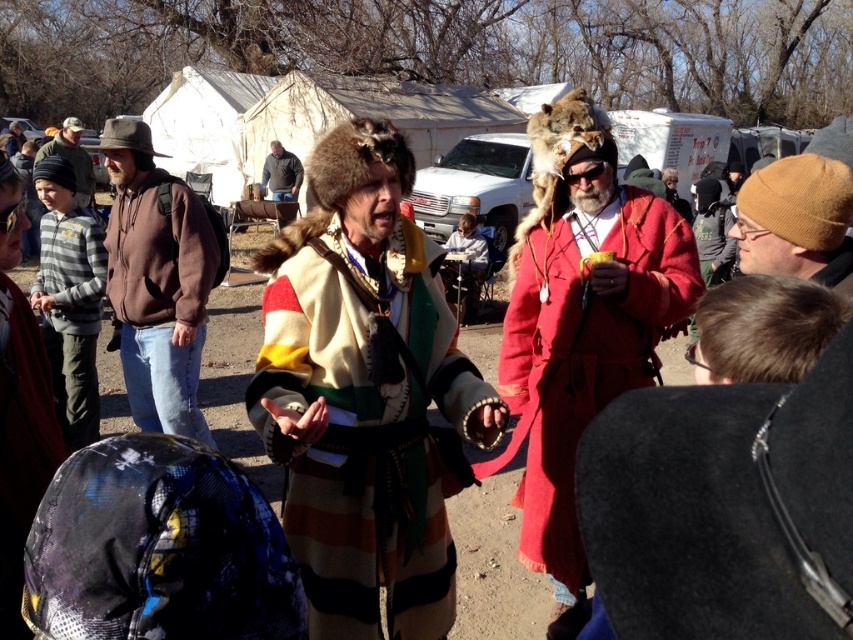
You are a costume designer preparing for a play. You have two jackets to choose from for the main character. The striped woolen coat at center and the dark gray hoodie at center. The character needs a jacket that is more formfitting. Which one should you choose?

The striped woolen coat at center is thinner than the dark gray hoodie at center, so the striped woolen coat at center is more formfitting and would be the better choice for the character.

In the scene shown: You are standing at the point marked as point (x=398, y=396) in the image. You want to walk straight towards the direction where the viewer is located. How far will you have to walk to reach the viewer?

The distance between point (x=398, y=396) and the viewer is 2.49 meters, so you will have to walk 2.49 meters to reach the viewer.